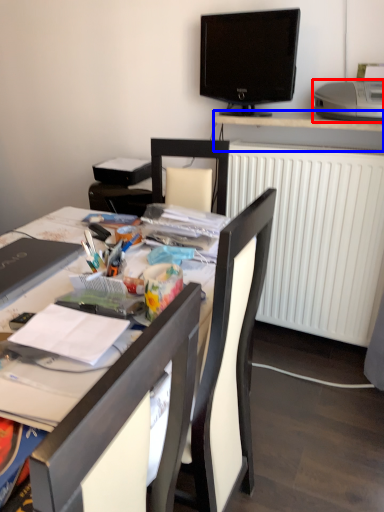
Question: Which object appears closest to the camera in this image, printer (highlighted by a red box) or desk (highlighted by a blue box)?

Choices:
 (A) printer
 (B) desk

Answer: (A)